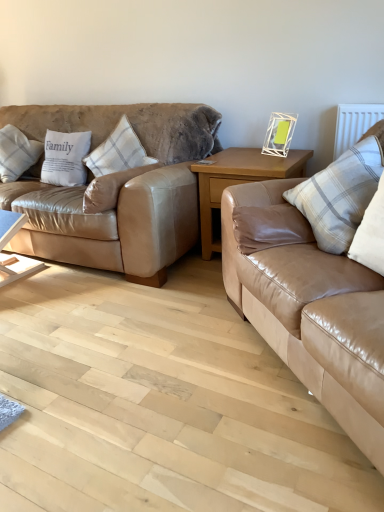
Find the location of `free space in front of light wood table at lower left, positioned as the 1th table in left-to-right order`. free space in front of light wood table at lower left, positioned as the 1th table in left-to-right order is located at coordinates (18, 292).